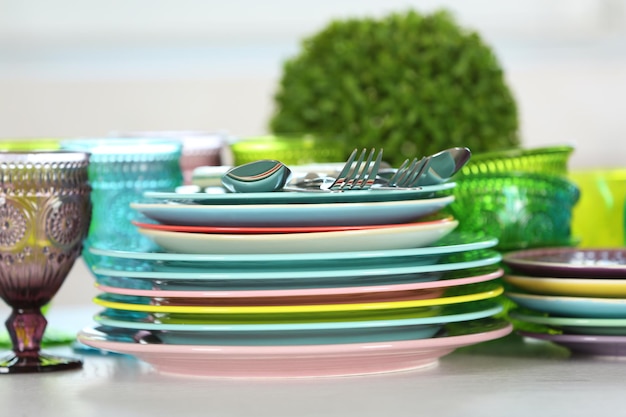
What are the coordinates of `blue plate` in the screenshot? It's located at (298, 193), (298, 203), (282, 253), (284, 271), (561, 301).